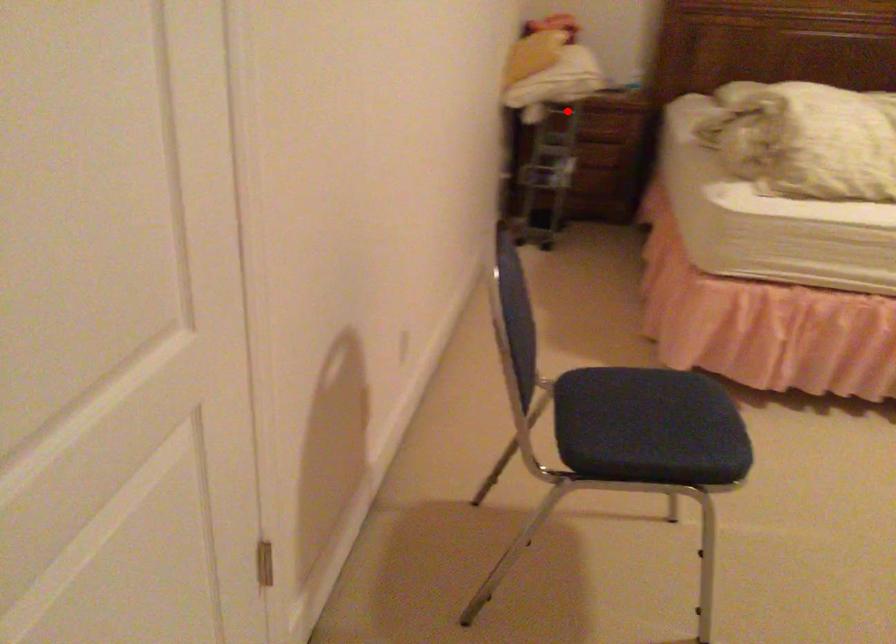
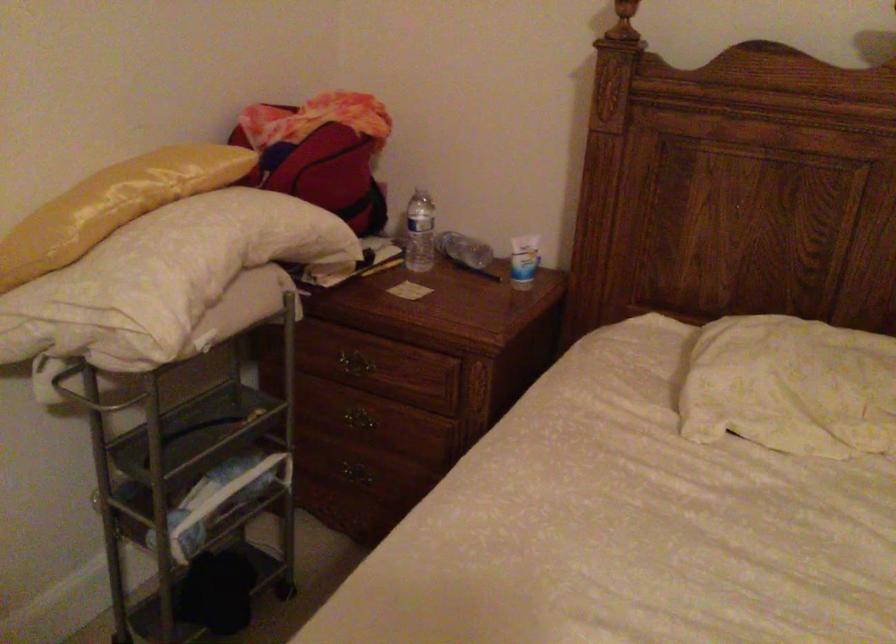
Where in the second image is the point corresponding to the highlighted location from the first image?

(350, 365)